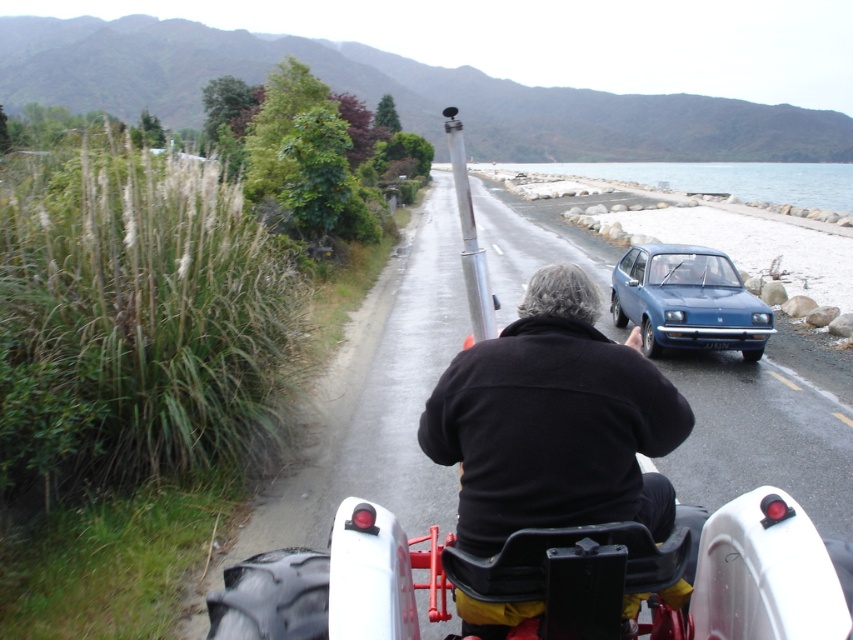
You are standing at point (805, 200) and want to walk to the person sitting on the red and white motorized vehicle. Which direction should you go relative to point (664, 259)?

You should go in the direction of point (664, 259) because it is in front of point (805, 200), so moving towards it will lead you closer to the person on the vehicle.